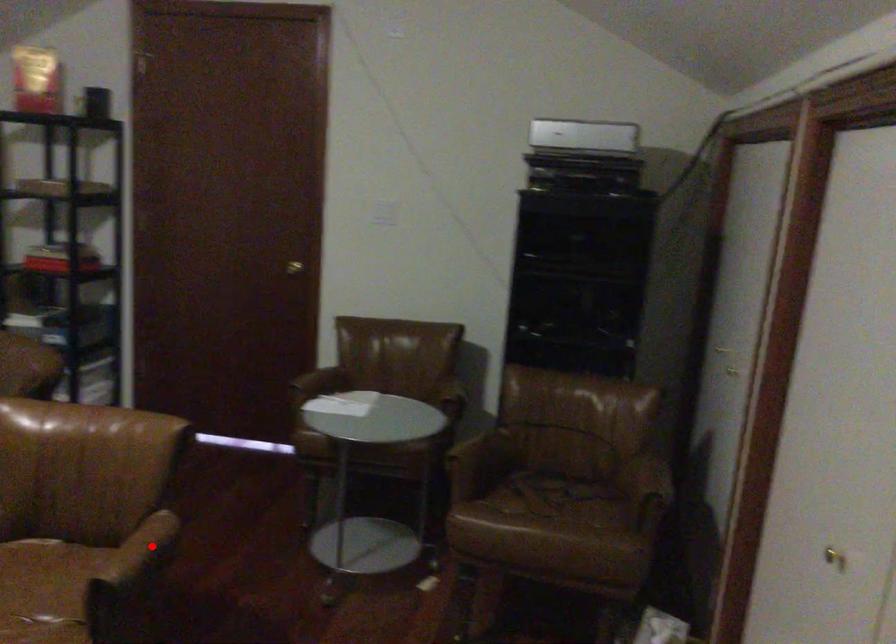
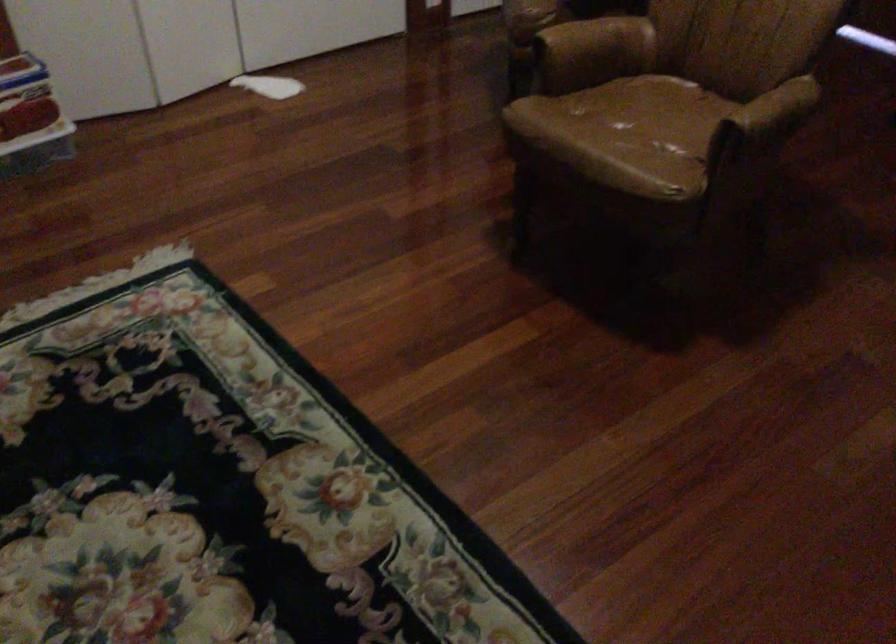
The point at the highlighted location is marked in the first image. Where is the corresponding point in the second image?

(776, 109)